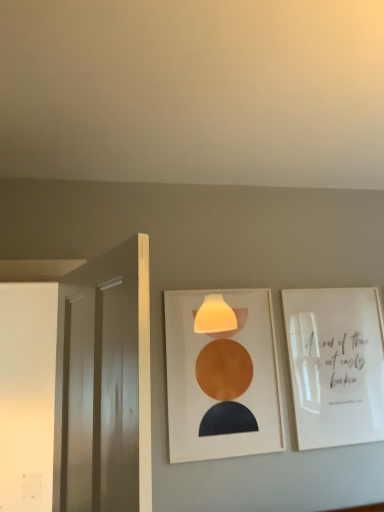
Question: Does white glossy door at left lie in front of white glossy picture frame at upper right, which is counted as the 2th picture frame, starting from the left?

Choices:
 (A) yes
 (B) no

Answer: (A)

Question: Considering the relative sizes of white glossy door at left and white glossy picture frame at upper right, which is counted as the 2th picture frame, starting from the left, in the image provided, is white glossy door at left thinner than white glossy picture frame at upper right, which is counted as the 2th picture frame, starting from the left,?

Choices:
 (A) yes
 (B) no

Answer: (B)

Question: Is white glossy picture frame at upper right, which is counted as the 2th picture frame, starting from the left, inside white glossy door at left?

Choices:
 (A) no
 (B) yes

Answer: (A)

Question: Is white glossy picture frame at upper right, the 1th picture frame viewed from the right, at the back of white glossy door at left?

Choices:
 (A) no
 (B) yes

Answer: (B)

Question: From the image's perspective, is white glossy door at left located above white glossy picture frame at upper right, the 1th picture frame viewed from the right?

Choices:
 (A) yes
 (B) no

Answer: (A)

Question: From the image's perspective, is white glossy door at left located beneath white glossy picture frame at upper right, the 1th picture frame viewed from the right?

Choices:
 (A) no
 (B) yes

Answer: (A)

Question: From the image's perspective, is matte white picture frame at center, which appears as the second picture frame when viewed from the right, located beneath white glossy door at left?

Choices:
 (A) yes
 (B) no

Answer: (A)

Question: From a real-world perspective, is matte white picture frame at center, acting as the first picture frame starting from the left, beneath white glossy door at left?

Choices:
 (A) yes
 (B) no

Answer: (B)

Question: Are matte white picture frame at center, which appears as the second picture frame when viewed from the right, and white glossy door at left far apart?

Choices:
 (A) no
 (B) yes

Answer: (A)

Question: Does matte white picture frame at center, acting as the first picture frame starting from the left, have a smaller size compared to white glossy door at left?

Choices:
 (A) no
 (B) yes

Answer: (B)

Question: Would you say matte white picture frame at center, which appears as the second picture frame when viewed from the right, contains white glossy door at left?

Choices:
 (A) no
 (B) yes

Answer: (A)

Question: Is matte white picture frame at center, acting as the first picture frame starting from the left, at the left side of white glossy door at left?

Choices:
 (A) yes
 (B) no

Answer: (B)

Question: Is white glossy picture frame at upper right, the 1th picture frame viewed from the right, positioned far away from white glossy door at left?

Choices:
 (A) yes
 (B) no

Answer: (A)